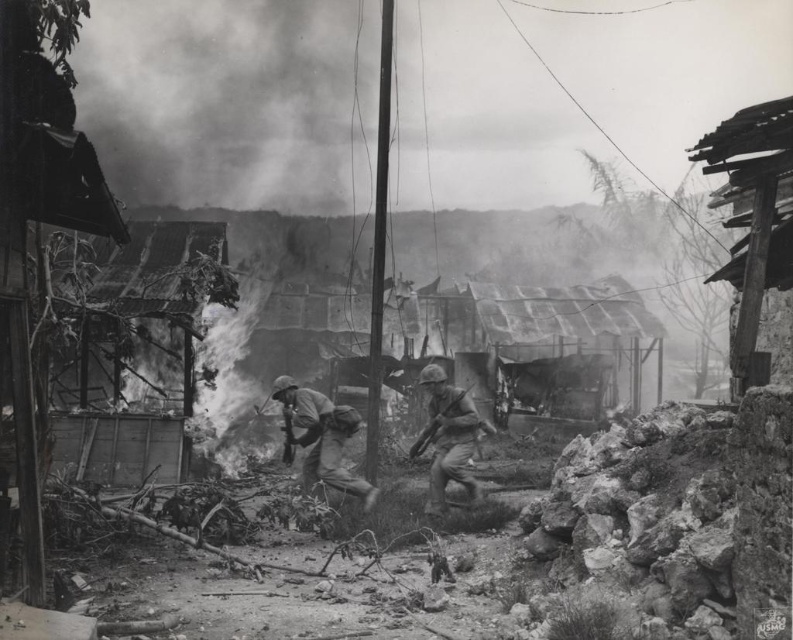
You are a drone operator analyzing a satellite image of a war zone. You notice two points marked on the image at coordinates point (343, 413) and point (446, 406). Based on the scene, which point is closer to the camera?

Point (343, 413) is closer to the viewer than point (446, 406).

You are a soldier in the image and need to move from the rusty corrugated metal hut at right to the camouflage fabric helmet at center. Which direction should you move to get closer to the helmet?

You should move towards the camouflage fabric helmet at center from the rusty corrugated metal hut at right since it is located at the center, while the hut is at the right side of the scene.

You are a soldier navigating through the war zone. You see the rusty corrugated metal hut at right and the camouflage fabric uniform at center. Which object is located to the right of the other?

The rusty corrugated metal hut at right is positioned on the right side of the camouflage fabric uniform at center, so the rusty corrugated metal hut at right is to the right of the camouflage fabric uniform at center.